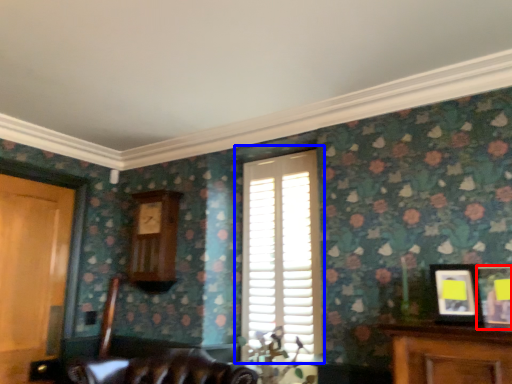
Question: Which object is further to the camera taking this photo, picture frame (highlighted by a red box) or window (highlighted by a blue box)?

Choices:
 (A) picture frame
 (B) window

Answer: (B)